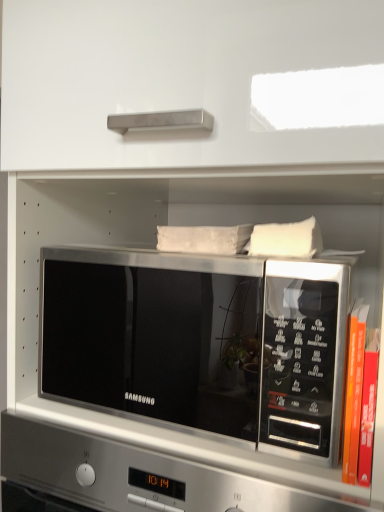
Question: Is white soft pillow at upper right located within orange hardcover book at right?

Choices:
 (A) yes
 (B) no

Answer: (B)

Question: From the image's perspective, is orange hardcover book at right located beneath white soft pillow at upper right?

Choices:
 (A) yes
 (B) no

Answer: (A)

Question: Does orange hardcover book at right have a greater height compared to white soft pillow at upper right?

Choices:
 (A) no
 (B) yes

Answer: (B)

Question: Is orange hardcover book at right looking in the opposite direction of white soft pillow at upper right?

Choices:
 (A) yes
 (B) no

Answer: (B)

Question: Is orange hardcover book at right smaller than white soft pillow at upper right?

Choices:
 (A) yes
 (B) no

Answer: (A)

Question: In the image, is satin silver microwave at center on the left side or the right side of white soft pillow at upper right?

Choices:
 (A) right
 (B) left

Answer: (B)

Question: From a real-world perspective, is satin silver microwave at center physically located above or below white soft pillow at upper right?

Choices:
 (A) above
 (B) below

Answer: (B)

Question: Considering the positions of satin silver microwave at center and white soft pillow at upper right in the image, is satin silver microwave at center taller or shorter than white soft pillow at upper right?

Choices:
 (A) short
 (B) tall

Answer: (B)

Question: Do you think satin silver microwave at center is within white soft pillow at upper right, or outside of it?

Choices:
 (A) outside
 (B) inside

Answer: (A)

Question: Based on their positions, is satin silver microwave at center located to the left or right of orange hardcover book at right?

Choices:
 (A) right
 (B) left

Answer: (B)

Question: Choose the correct answer: Is satin silver microwave at center inside orange hardcover book at right or outside it?

Choices:
 (A) outside
 (B) inside

Answer: (A)

Question: Is point (329, 291) positioned closer to the camera than point (365, 481)?

Choices:
 (A) farther
 (B) closer

Answer: (A)

Question: Is satin silver microwave at center bigger or smaller than orange hardcover book at right?

Choices:
 (A) small
 (B) big

Answer: (B)

Question: Is point (254, 232) closer or farther from the camera than point (354, 321)?

Choices:
 (A) closer
 (B) farther

Answer: (B)

Question: From the image's perspective, is white soft pillow at upper right positioned above or below orange hardcover book at right?

Choices:
 (A) below
 (B) above

Answer: (B)